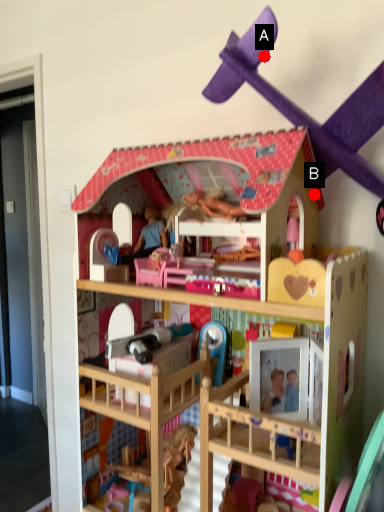
Question: Two points are circled on the image, labeled by A and B beside each circle. Which point is closer to the camera?

Choices:
 (A) A is closer
 (B) B is closer

Answer: (B)